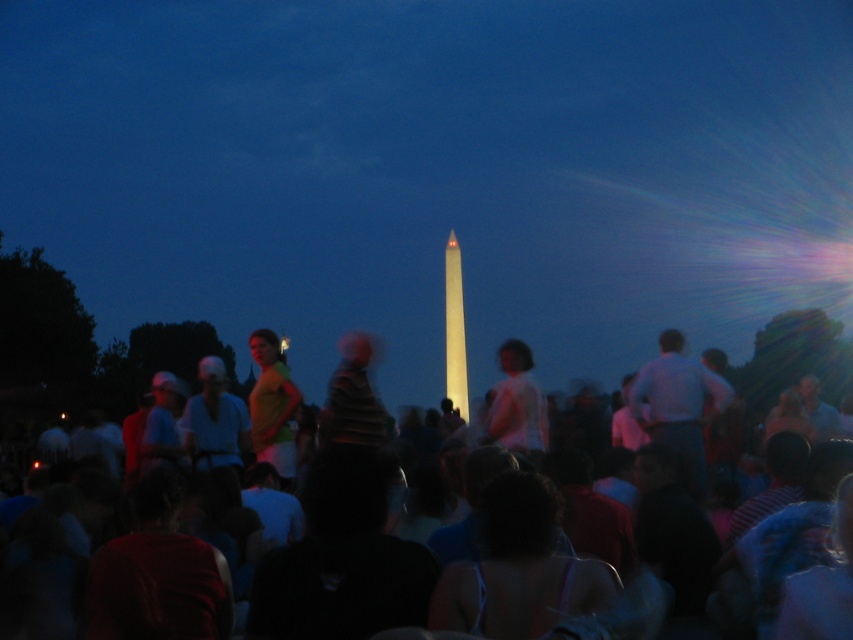
You are a photographer trying to capture a clear shot of the yellow fabric shirt at center in the evening scene. The black cotton crowd at center is blocking your view. Can you estimate whether the crowd is taller than the shirt?

The black cotton crowd at center is taller than yellow fabric shirt at center, so the crowd is blocking the view of the shirt.

You are a photographer trying to capture a photo of the yellow fabric shirt at center without including the black cotton crowd at center. Based on their positions, which direction should you move your camera to exclude the crowd?

The black cotton crowd at center is to the right of the yellow fabric shirt at center. To exclude the crowd, move your camera to the right side of the yellow fabric shirt at center.

You are standing at the origin point in the scene and want to find the white matte shirt at center. According to the coordinates provided, in which direction should you look to locate it?

The white matte shirt at center is located at coordinates point (517, 403), which means it is to the right and slightly below your current position. You should look to your right and down to find it.